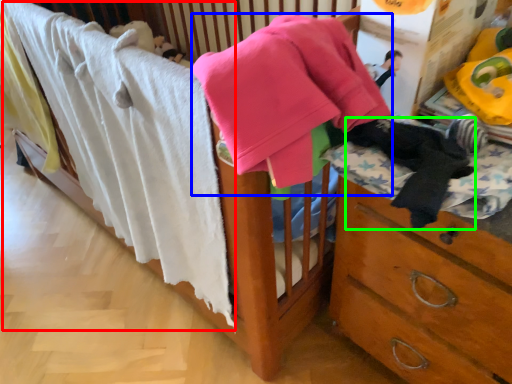
Question: Considering the real-world distances, which object is closest to bath towel (highlighted by a red box)? baby clothe (highlighted by a blue box) or clothing (highlighted by a green box).

Choices:
 (A) baby clothe
 (B) clothing

Answer: (A)